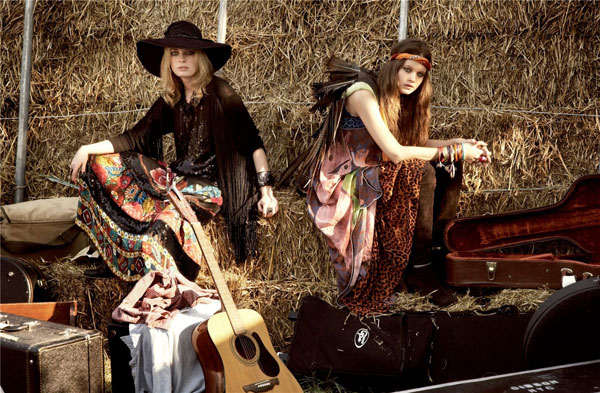
In order to click on guitar case in this screenshot , I will do click(583, 227).